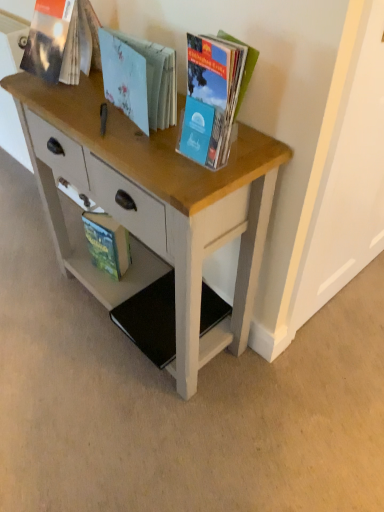
Where is `unoccupied area in front of wooden desk at center`? unoccupied area in front of wooden desk at center is located at coordinates (147, 430).